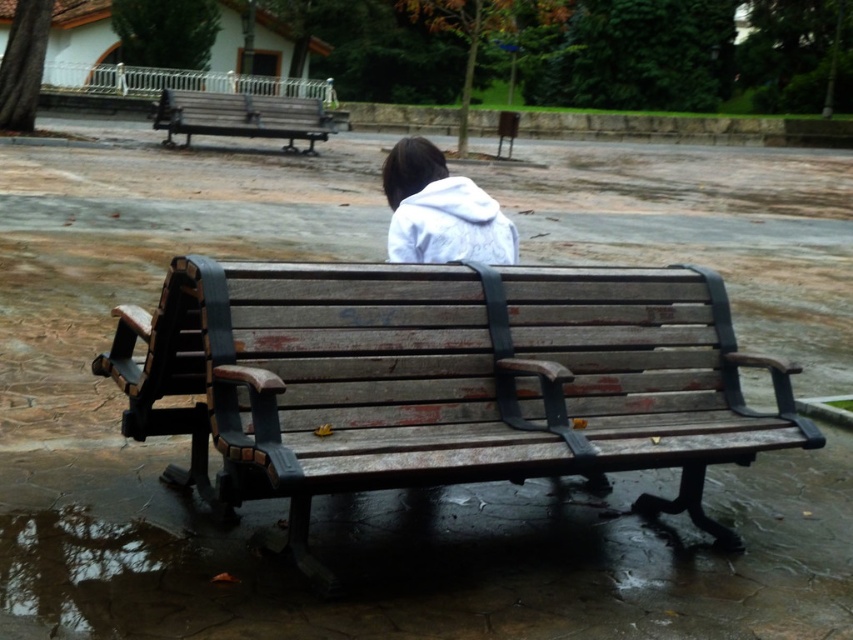
The height and width of the screenshot is (640, 853). Describe the element at coordinates (440, 211) in the screenshot. I see `white fleece jacket at center` at that location.

Between white fleece jacket at center and weathered wood bench at upper left, which one appears on the right side from the viewer's perspective?

Positioned to the right is white fleece jacket at center.

Measure the distance between white fleece jacket at center and camera.

They are 10.29 feet apart.

Where is `white fleece jacket at center`? This screenshot has width=853, height=640. white fleece jacket at center is located at coordinates (440, 211).